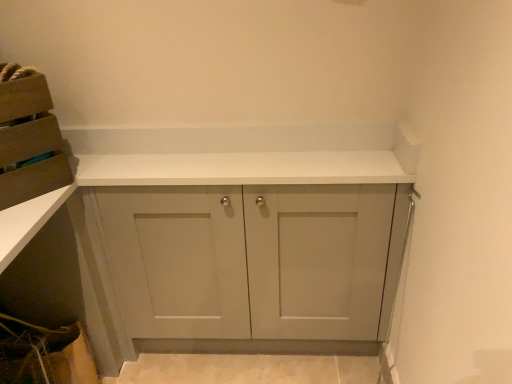
Question: Is matte cardboard box at upper left, the 2th cabinetry from the right, inside the boundaries of white matte cabinet at center, marked as the first cabinetry in a right-to-left arrangement, or outside?

Choices:
 (A) outside
 (B) inside

Answer: (A)

Question: From their relative heights in the image, would you say matte cardboard box at upper left, placed as the 1th cabinetry when sorted from left to right, is taller or shorter than white matte cabinet at center, marked as the first cabinetry in a right-to-left arrangement?

Choices:
 (A) short
 (B) tall

Answer: (A)

Question: Looking at the image, does matte cardboard box at upper left, the 2th cabinetry from the right, seem bigger or smaller compared to white matte cabinet at center, marked as the first cabinetry in a right-to-left arrangement?

Choices:
 (A) big
 (B) small

Answer: (B)

Question: Considering their positions, is white matte cabinet at center, positioned as the second cabinetry in left-to-right order, located in front of or behind matte cardboard box at upper left, the 2th cabinetry from the right?

Choices:
 (A) behind
 (B) front

Answer: (A)

Question: Is point (262, 208) closer or farther from the camera than point (11, 96)?

Choices:
 (A) farther
 (B) closer

Answer: (A)

Question: From the image's perspective, is white matte cabinet at center, positioned as the second cabinetry in left-to-right order, positioned above or below matte cardboard box at upper left, placed as the 1th cabinetry when sorted from left to right?

Choices:
 (A) above
 (B) below

Answer: (B)

Question: Considering the positions of white matte cabinet at center, positioned as the second cabinetry in left-to-right order, and matte cardboard box at upper left, the 2th cabinetry from the right, in the image, is white matte cabinet at center, positioned as the second cabinetry in left-to-right order, wider or thinner than matte cardboard box at upper left, the 2th cabinetry from the right,?

Choices:
 (A) wide
 (B) thin

Answer: (B)